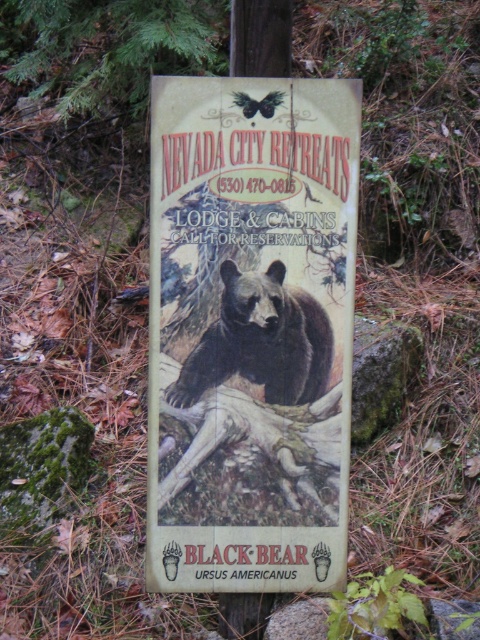
Can you confirm if wooden signboard at center is smaller than wooden sign at center?

Actually, wooden signboard at center might be larger than wooden sign at center.

The height and width of the screenshot is (640, 480). What do you see at coordinates (251, 332) in the screenshot?
I see `wooden signboard at center` at bounding box center [251, 332].

You are a GUI agent. You are given a task and a screenshot of the screen. Output one action in this format:
    pyautogui.click(x=<x>, y=<y>)
    Task: Click on the wooden signboard at center
    The image size is (480, 640).
    Given the screenshot: What is the action you would take?
    pyautogui.click(x=251, y=332)

The width and height of the screenshot is (480, 640). What are the coordinates of `wooden signboard at center` in the screenshot? It's located at (x=251, y=332).

Is wooden signboard at center closer to camera compared to brown fur bear at center?

That is True.

Where is `wooden signboard at center`? wooden signboard at center is located at coordinates (x=251, y=332).

Locate an element on the screen. The width and height of the screenshot is (480, 640). wooden signboard at center is located at coordinates (251, 332).

Is brown fur bear at center below wooden sign at center?

Yes, brown fur bear at center is below wooden sign at center.

Which of these two, brown fur bear at center or wooden sign at center, stands shorter?

wooden sign at center

The height and width of the screenshot is (640, 480). What do you see at coordinates (261, 340) in the screenshot?
I see `brown fur bear at center` at bounding box center [261, 340].

Find the location of a particular element. The image size is (480, 640). brown fur bear at center is located at coordinates (261, 340).